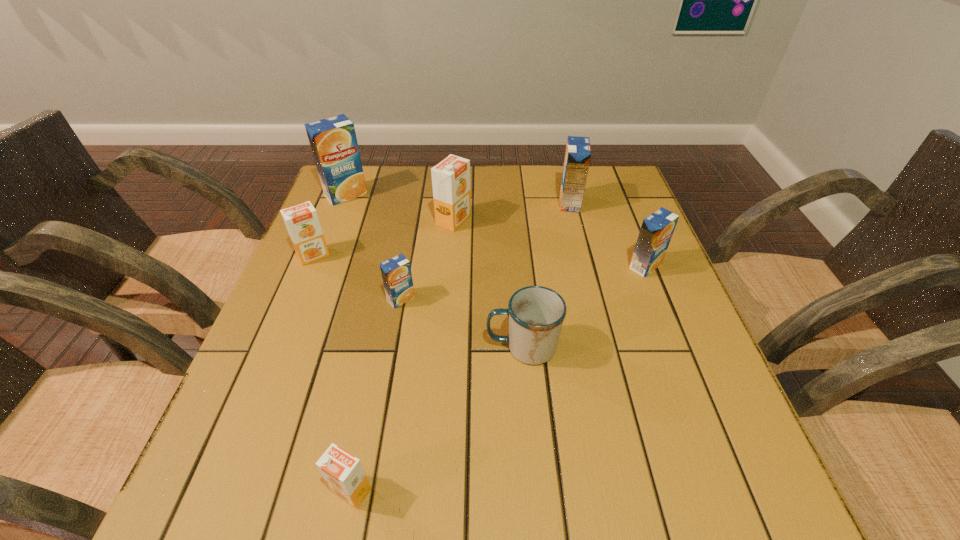
You are a GUI agent. You are given a task and a screenshot of the screen. Output one action in this format:
    pyautogui.click(x=<x>, y=<y>)
    Task: Click on the tallest orange juice
    
    Given the screenshot: What is the action you would take?
    pyautogui.click(x=333, y=141)

Find the location of a particular element. This screenshot has height=540, width=960. the biggest blue orange_juice is located at coordinates (333, 141).

Where is `the third smallest blue orange_juice`? This screenshot has height=540, width=960. the third smallest blue orange_juice is located at coordinates (578, 151).

Where is `the second blue orange_juice from right to left`? This screenshot has width=960, height=540. the second blue orange_juice from right to left is located at coordinates (578, 151).

At what (x,y) coordinates should I click in order to perform the action: click on the rightmost orange orange juice. Please return your answer as a coordinate pair (x, y). Image resolution: width=960 pixels, height=540 pixels. Looking at the image, I should click on (451, 177).

The image size is (960, 540). What are the coordinates of `the fifth orange juice from left to right` in the screenshot? It's located at (451, 177).

The height and width of the screenshot is (540, 960). What are the coordinates of `the second nearest orange orange juice` in the screenshot? It's located at (302, 223).

The height and width of the screenshot is (540, 960). What are the coordinates of `the second biggest orange orange juice` in the screenshot? It's located at (302, 223).

Image resolution: width=960 pixels, height=540 pixels. What are the coordinates of `the second nearest blue orange_juice` in the screenshot? It's located at pos(657,229).

At what (x,y) coordinates should I click in order to perform the action: click on the rightmost blue orange_juice. Please return your answer as a coordinate pair (x, y). Looking at the image, I should click on (657, 229).